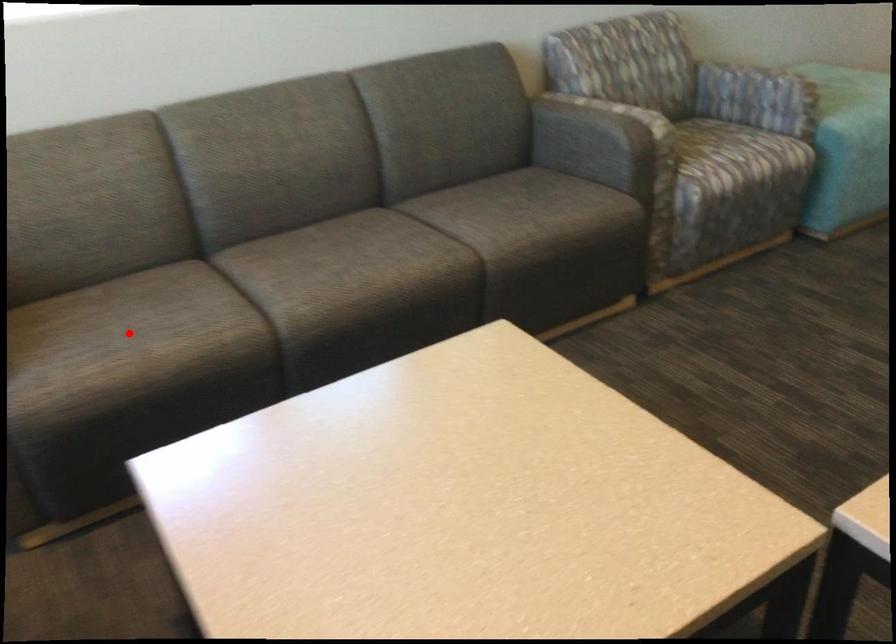
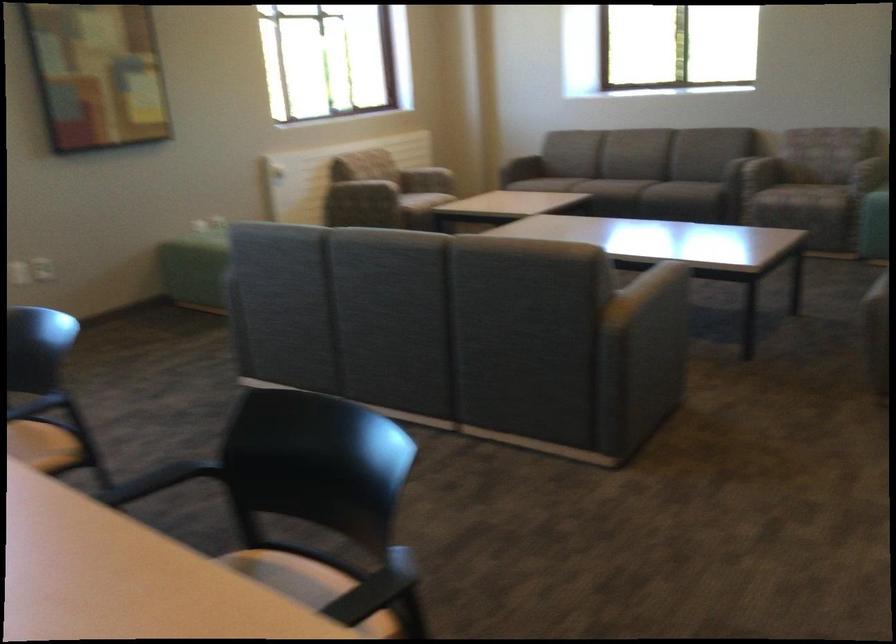
Question: I am providing you with two images of the same scene from different viewpoints. Image1 has a red point marked. In image2, the corresponding 3D location appears at what relative position? Reply with the corresponding letter.

Choices:
 (A) Closer
 (B) Farther

Answer: (B)